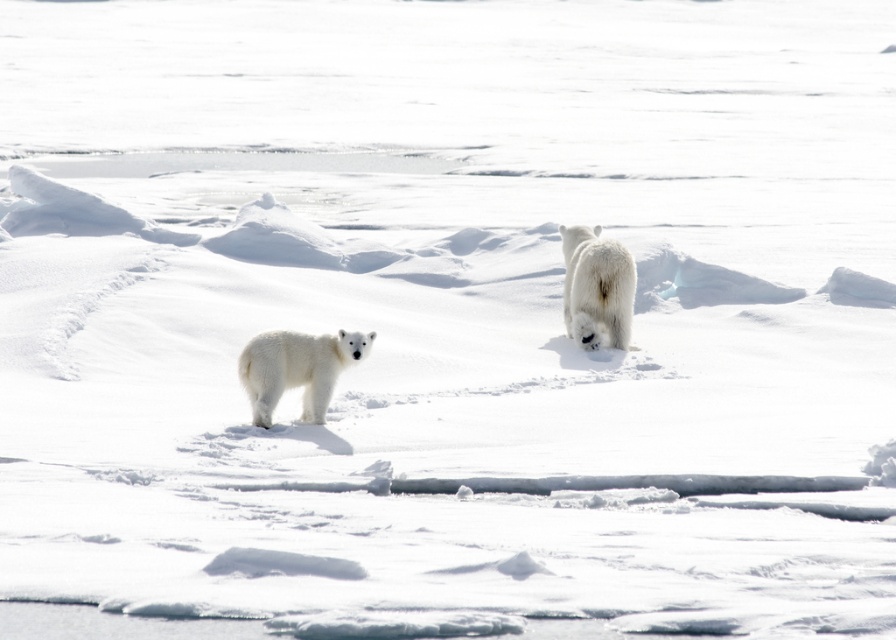
You are a photographer trying to capture a photo of the white fluffy bear at center and the white fur bear at center. Which bear should you adjust your camera focus to first if you want to focus on the one closer to you?

The white fluffy bear at center is to the left of white fur bear at center, so you should focus on the white fluffy bear at center first as it is closer to you.

You are a photographer trying to capture the polar bear in the foreground. You notice two points marked in the image, point A at coordinates point (297,384) and point B at coordinates point (589,333). Which point is closer to your camera so you can focus on it for a clearer shot?

Point (297,384) is closer to the camera than point (589,333), so you should focus on point (297,384) for a clearer shot.

You are a photographer trying to capture the white fluffy bear at center and the white fur bear at center in a single shot. Which bear will appear larger in the photo?

The white fluffy bear at center will appear larger in the photo because it is closer to the camera than the white fur bear at center.